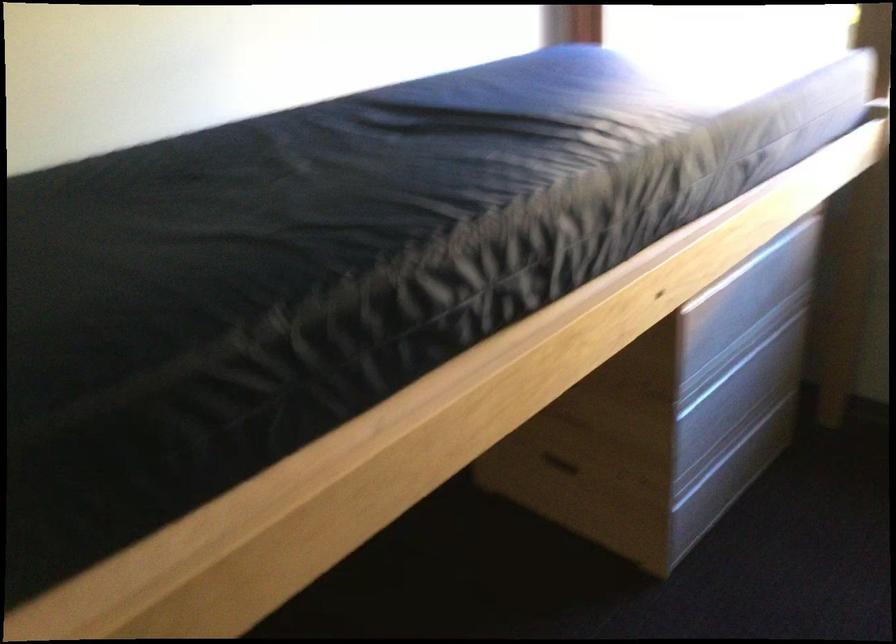
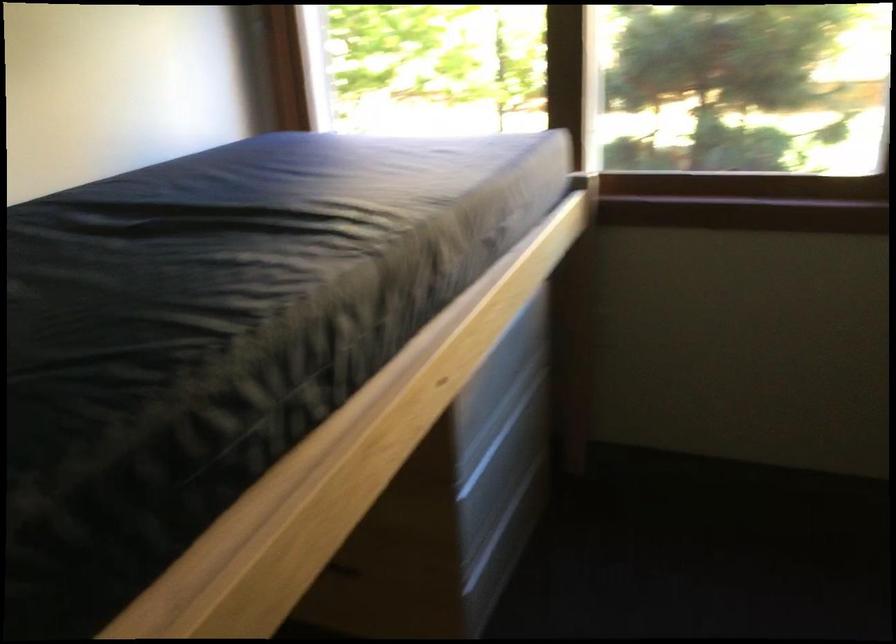
Question: The images are taken continuously from a first-person perspective. In which direction is your viewpoint rotating?

Choices:
 (A) Left
 (B) Right
 (C) Up
 (D) Down

Answer: (B)